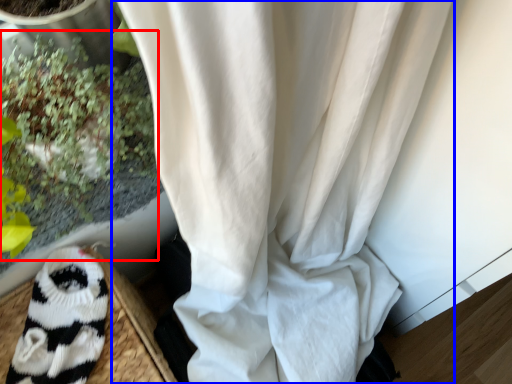
Question: Which point is further to the camera, floral arrangement (highlighted by a red box) or curtain (highlighted by a blue box)?

Choices:
 (A) floral arrangement
 (B) curtain

Answer: (B)